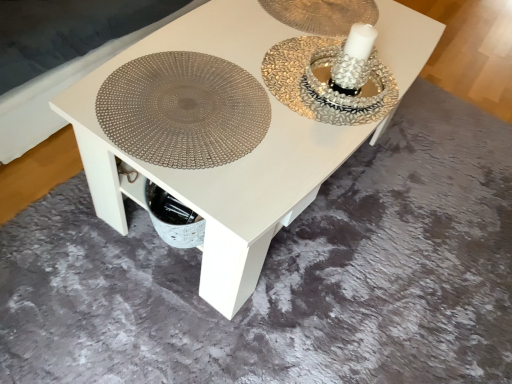
Locate an element on the screen. free space above matte silver platter at center (from a real-world perspective) is located at coordinates (199, 97).